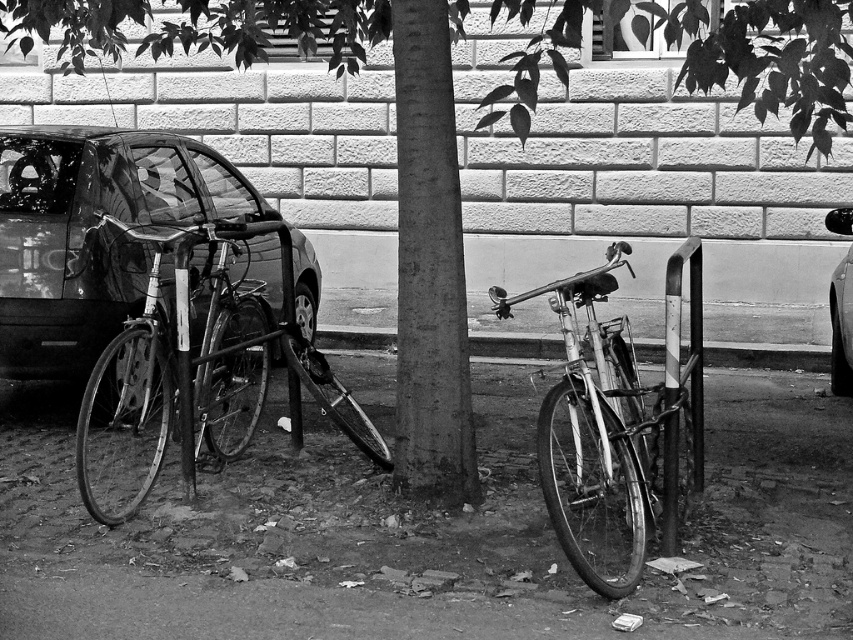
You are a delivery person who needs to load a package onto the shiny silver bicycle at center and the metallic silver car at right. Since both are silver, which one is closer to the left side of the image?

The shiny silver bicycle at center is to the left of the metallic silver car at right, so the shiny silver bicycle at center is closer to the left side of the image.

You are a delivery person needing to park your 2.5 meter long motorcycle between the glossy metallic car at left and the metallic silver car at right. Can you fit it there?

The glossy metallic car at left is 4.84 meters from the metallic silver car at right, so yes, the motorcycle can fit between them since the distance is greater than the motorcycle length.